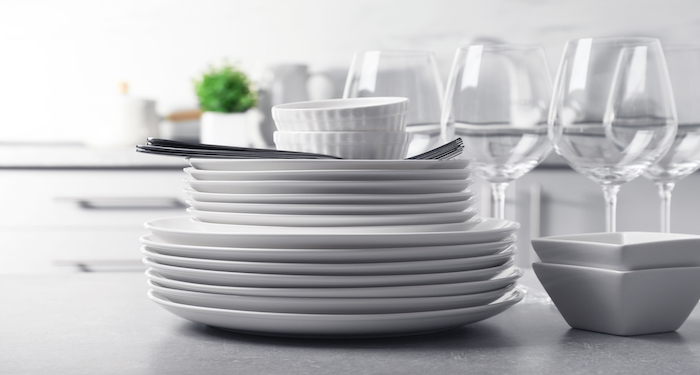
Locate an element on the screen. bowl is located at coordinates (600, 249), (589, 295), (379, 143), (370, 118).